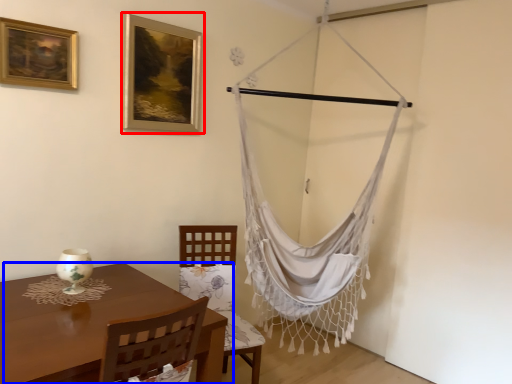
Question: Among these objects, which one is nearest to the camera, picture frame (highlighted by a red box) or table (highlighted by a blue box)?

Choices:
 (A) picture frame
 (B) table

Answer: (B)